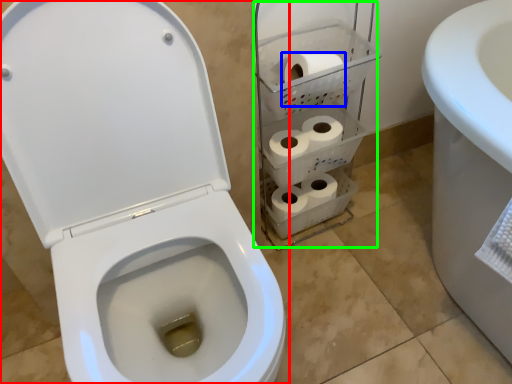
Question: Which is farther away from toilet (highlighted by a red box)? to paper (highlighted by a blue box) or shelf (highlighted by a green box)?

Choices:
 (A) to paper
 (B) shelf

Answer: (A)